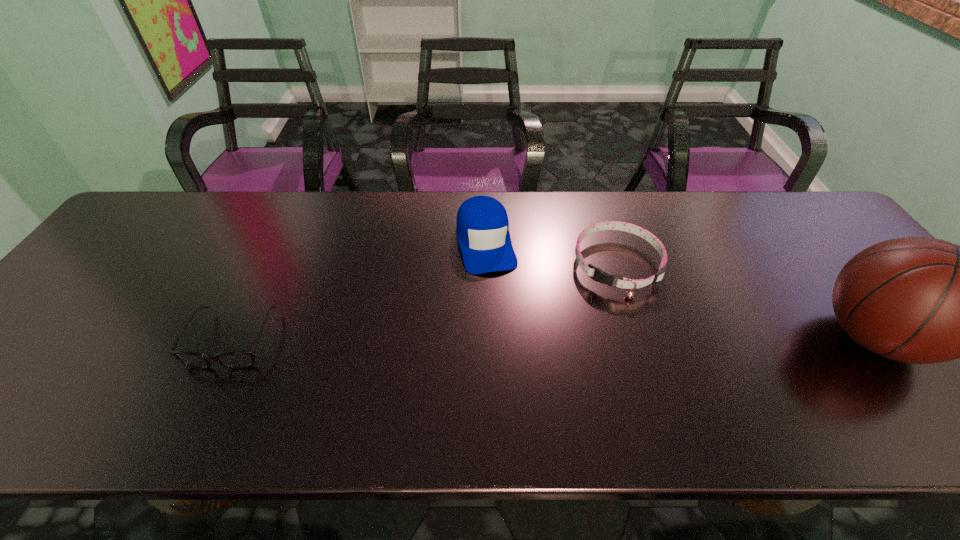
Where is `the leftmost object`? the leftmost object is located at coordinates (233, 359).

This screenshot has width=960, height=540. In order to click on dog collar in this screenshot , I will do `click(600, 276)`.

The height and width of the screenshot is (540, 960). In order to click on the second tallest object in this screenshot , I will do `click(482, 226)`.

Find the location of a particular element. This screenshot has height=540, width=960. the second object from left to right is located at coordinates (482, 226).

You are a GUI agent. You are given a task and a screenshot of the screen. Output one action in this format:
    pyautogui.click(x=<x>, y=<y>)
    Task: Click on the free space located 0.160m with the buckle on the second object from right to left
    The image size is (960, 540).
    Given the screenshot: What is the action you would take?
    pyautogui.click(x=578, y=340)

Where is `blank area located 0.200m with the buckle on the second object from right to left`? This screenshot has width=960, height=540. blank area located 0.200m with the buckle on the second object from right to left is located at coordinates (571, 352).

You are a GUI agent. You are given a task and a screenshot of the screen. Output one action in this format:
    pyautogui.click(x=<x>, y=<y>)
    Task: Click on the free space located with the buckle on the second object from right to left
    Image resolution: width=960 pixels, height=540 pixels.
    Given the screenshot: What is the action you would take?
    pyautogui.click(x=571, y=352)

This screenshot has width=960, height=540. Identify the location of free space located 0.050m on the front-facing side of the third shortest object. (495, 288).

Where is `blank area located 0.110m on the front-facing side of the third shortest object`? This screenshot has width=960, height=540. blank area located 0.110m on the front-facing side of the third shortest object is located at coordinates (500, 306).

Find the location of a particular element. The width and height of the screenshot is (960, 540). free space located 0.180m on the front-facing side of the third shortest object is located at coordinates (x=506, y=328).